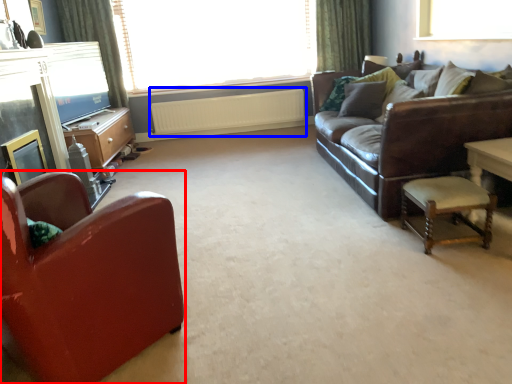
Question: Which object is closer to the camera taking this photo, chair (highlighted by a red box) or radiator (highlighted by a blue box)?

Choices:
 (A) chair
 (B) radiator

Answer: (A)